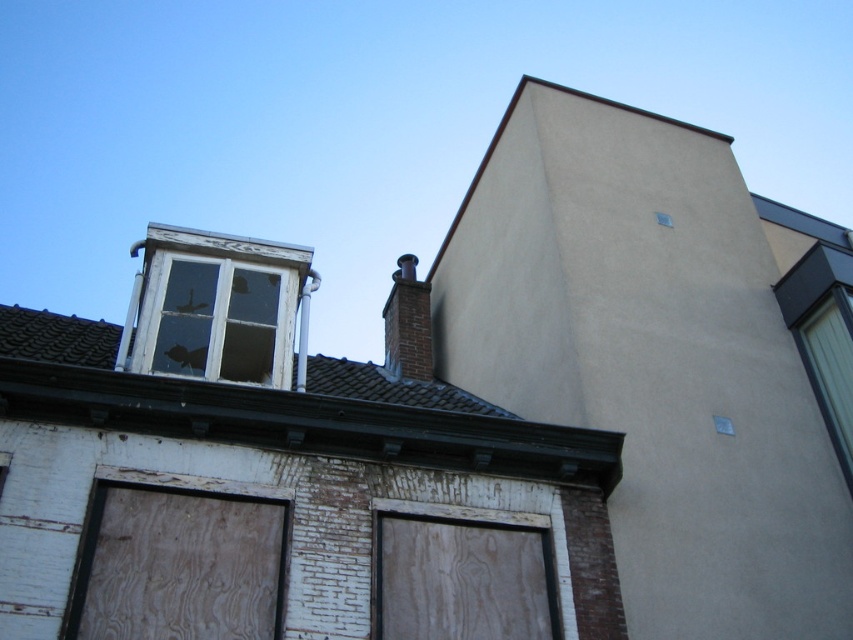
You are standing in front of the building and want to place a new sign that is 0.3 meters wide. The sign must be placed at the same location as the wooden board at lower left. Is there enough space for the sign?

The wooden board at lower left is located at point (178,564). Since the sign must be placed at the exact location of the wooden board at lower left, there is no space available as the board already occupies that position.